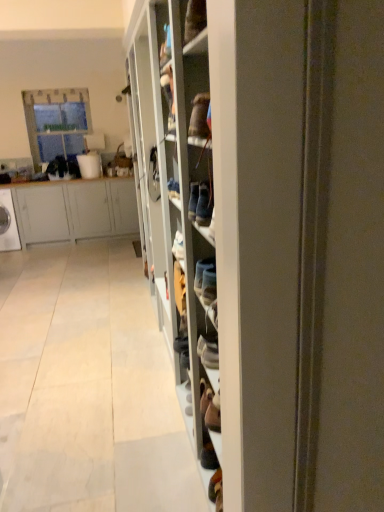
Question: Considering the relative sizes of matte gray cabinet at left and clear glass window at upper left in the image provided, is matte gray cabinet at left taller than clear glass window at upper left?

Choices:
 (A) no
 (B) yes

Answer: (A)

Question: Considering the relative positions of matte gray cabinet at left and clear glass window at upper left in the image provided, is matte gray cabinet at left in front of clear glass window at upper left?

Choices:
 (A) yes
 (B) no

Answer: (A)

Question: Can you confirm if matte gray cabinet at left is smaller than clear glass window at upper left?

Choices:
 (A) yes
 (B) no

Answer: (B)

Question: Is matte gray cabinet at left outside of clear glass window at upper left?

Choices:
 (A) yes
 (B) no

Answer: (A)

Question: From the image's perspective, is matte gray cabinet at left located beneath clear glass window at upper left?

Choices:
 (A) no
 (B) yes

Answer: (B)

Question: Looking at their shapes, would you say matte gray cabinet at left is wider or thinner than clear glass window at upper left?

Choices:
 (A) thin
 (B) wide

Answer: (B)

Question: From a real-world perspective, is matte gray cabinet at left physically located above or below clear glass window at upper left?

Choices:
 (A) above
 (B) below

Answer: (B)

Question: Considering their positions, is matte gray cabinet at left located in front of or behind clear glass window at upper left?

Choices:
 (A) front
 (B) behind

Answer: (A)

Question: From their relative heights in the image, would you say matte gray cabinet at left is taller or shorter than clear glass window at upper left?

Choices:
 (A) short
 (B) tall

Answer: (A)

Question: From the image's perspective, is clear glass window at upper left above or below wooden shoe rack at center?

Choices:
 (A) below
 (B) above

Answer: (B)

Question: Considering their positions, is clear glass window at upper left located in front of or behind wooden shoe rack at center?

Choices:
 (A) front
 (B) behind

Answer: (B)

Question: From a real-world perspective, is clear glass window at upper left physically located above or below wooden shoe rack at center?

Choices:
 (A) below
 (B) above

Answer: (B)

Question: From their relative heights in the image, would you say clear glass window at upper left is taller or shorter than wooden shoe rack at center?

Choices:
 (A) short
 (B) tall

Answer: (A)

Question: Looking at the image, does wooden shoe rack at center seem bigger or smaller compared to matte gray cabinet at left?

Choices:
 (A) big
 (B) small

Answer: (A)

Question: From the image's perspective, is wooden shoe rack at center positioned above or below matte gray cabinet at left?

Choices:
 (A) above
 (B) below

Answer: (B)